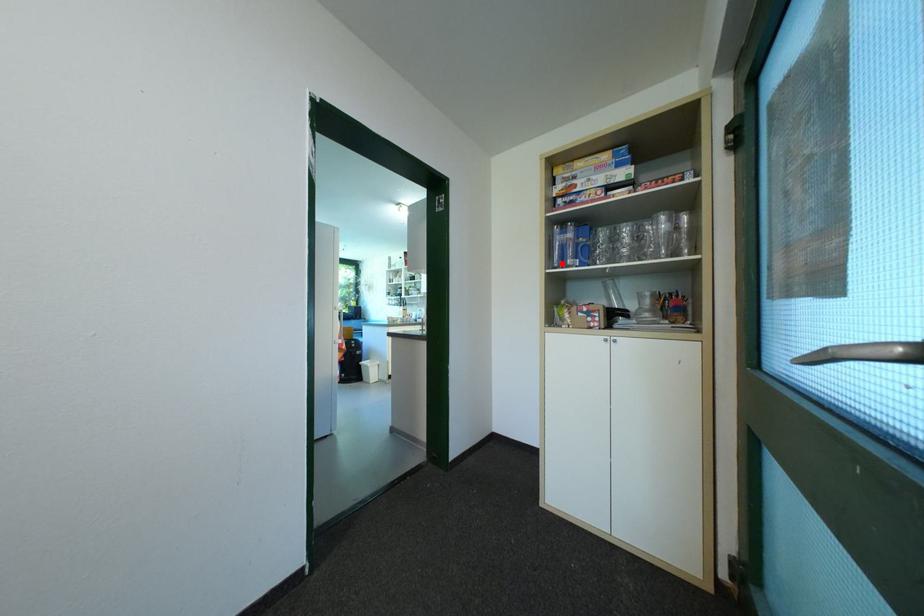
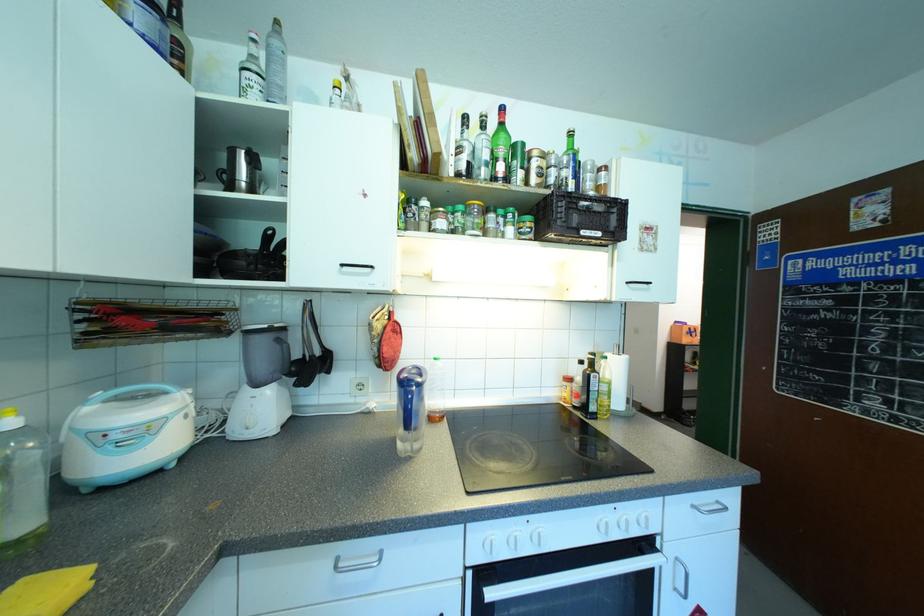
Question: I am providing you with two images of the same scene from different viewpoints. A red point is marked on the first image. Can you still see the location of the red point in image 2?

Choices:
 (A) Yes
 (B) No

Answer: (B)